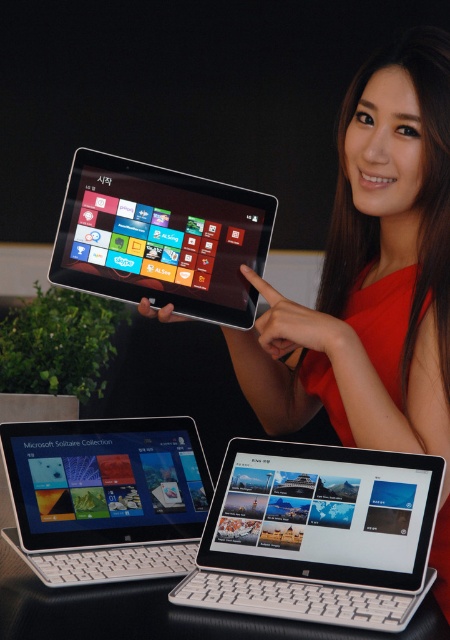
You are an event organizer setting up a tech showcase. You have a matte black laptop at center and a matte black tablet at center. Which device has a smaller screen width?

The matte black laptop at center has a lesser width compared to the matte black tablet at center, so the matte black laptop at center has the smaller screen width.

You are standing in front of the promotional display and want to touch both points marked on the image. Which point, point (79, 520) or point (76, 259), will require you to reach further out to touch it?

Point (76, 259) will require you to reach further out because it is farther from the viewer compared to point (79, 520).

In the scene shown: You are setting up a promotional display and want to ensure that the matte black laptop at center and the matte black tablet at center are visible to attendees. Since the tablet is held by a person, you can only adjust the laptop. Should you place the laptop closer to or farther from the audience to make both devices equally visible?

The matte black laptop at center is larger in size than the matte black tablet at center. To make both devices equally visible, you should place the laptop farther from the audience so that its larger size is balanced by the distance, matching the tablet visibility.